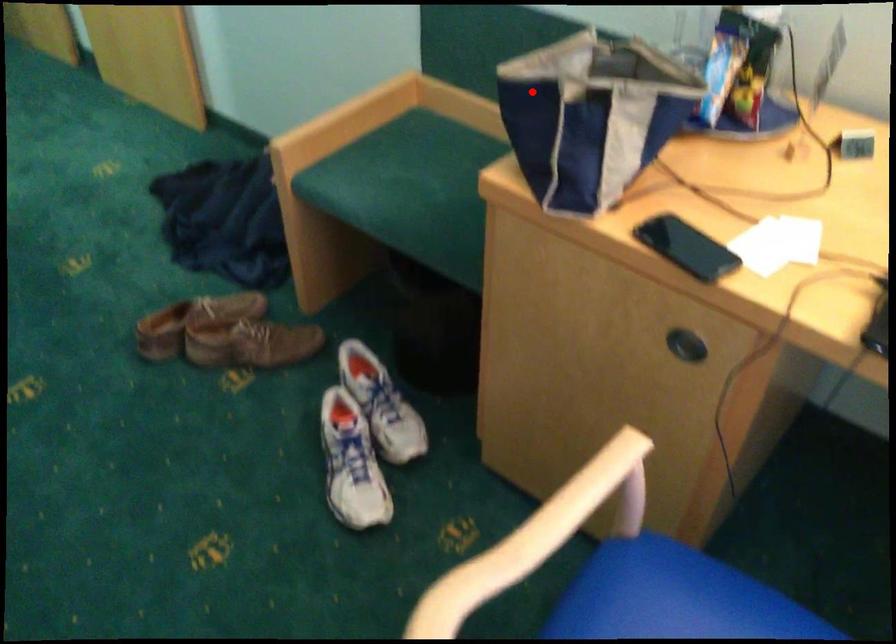
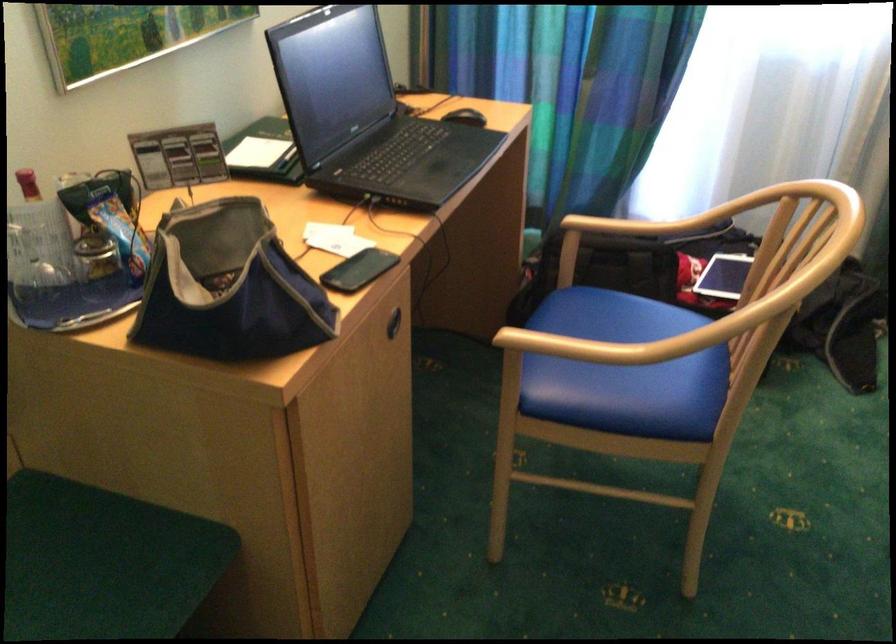
Locate, in the second image, the point that corresponds to the highlighted location in the first image.

(228, 287)